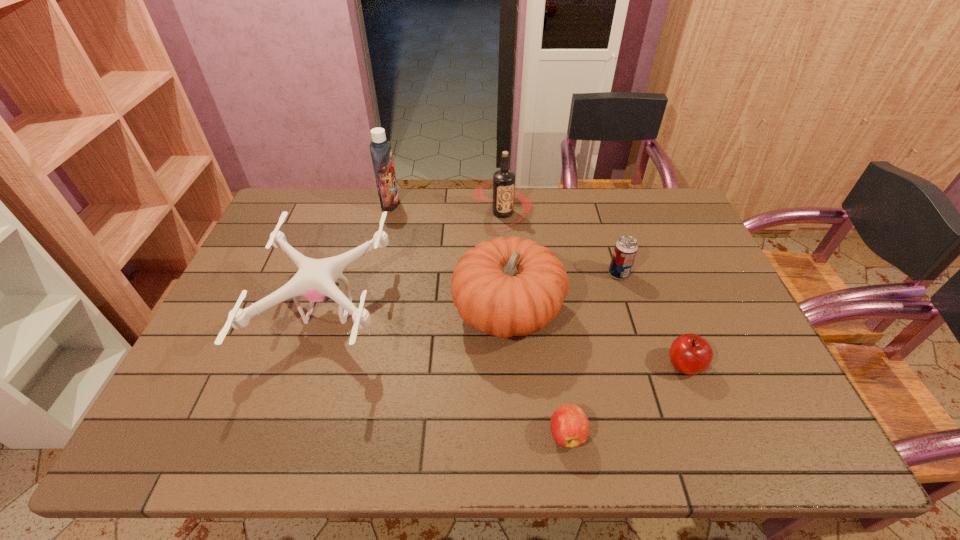
Locate an element on the screen. The width and height of the screenshot is (960, 540). object positioned at the left edge is located at coordinates (x=315, y=280).

Where is `object at the right edge`? object at the right edge is located at coordinates (690, 354).

You are a GUI agent. You are given a task and a screenshot of the screen. Output one action in this format:
    pyautogui.click(x=<x>, y=<y>)
    Task: Click on the free region at the far edge
    This screenshot has width=960, height=540.
    Given the screenshot: What is the action you would take?
    pyautogui.click(x=427, y=198)

Identify the location of free space at the near edge of the desktop. This screenshot has height=540, width=960. (359, 422).

The width and height of the screenshot is (960, 540). In the image, there is a desktop. What are the coordinates of `vacant space at the left edge` in the screenshot? It's located at (206, 339).

Identify the location of vacant space at the right edge of the desktop. This screenshot has height=540, width=960. (700, 256).

What are the coordinates of `free spot at the far left corner of the desktop` in the screenshot? It's located at (308, 196).

At what (x,y) coordinates should I click in order to perform the action: click on blank space at the far right corner of the desktop. Please return your answer as a coordinate pair (x, y). Looking at the image, I should click on (647, 208).

This screenshot has width=960, height=540. I want to click on vacant area that lies between the taller apple and the shorter apple, so click(626, 400).

Where is `empty location between the nearer apple and the fifth shortest object`? This screenshot has width=960, height=540. empty location between the nearer apple and the fifth shortest object is located at coordinates (538, 373).